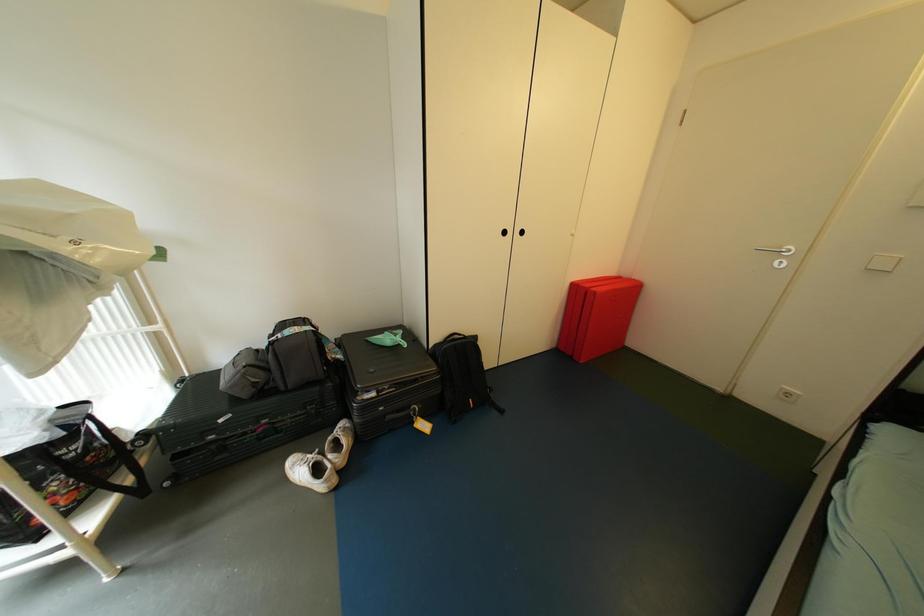
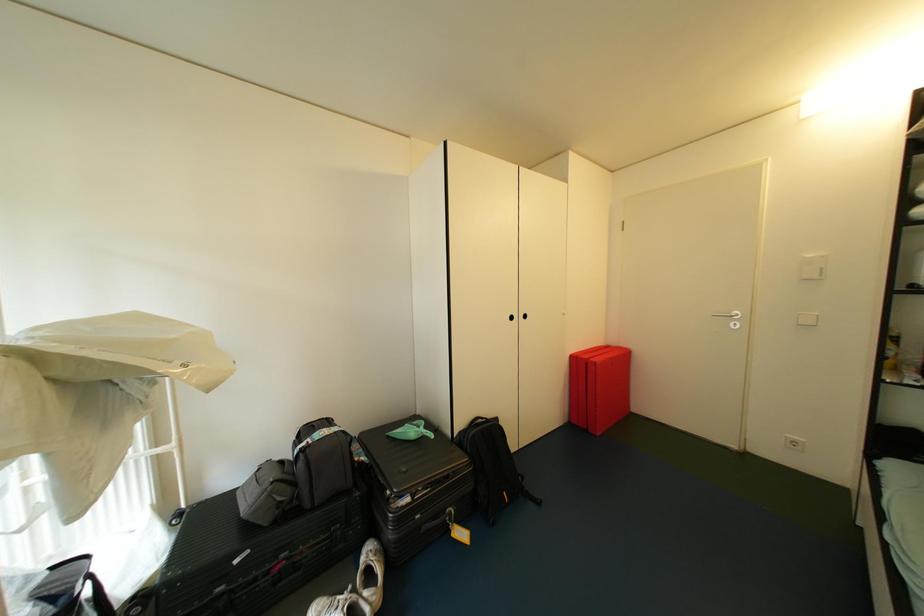
Question: The first image is from the beginning of the video and the second image is from the end. How did the camera likely rotate when shooting the video?

Choices:
 (A) Left
 (B) Right
 (C) Up
 (D) Down

Answer: (C)